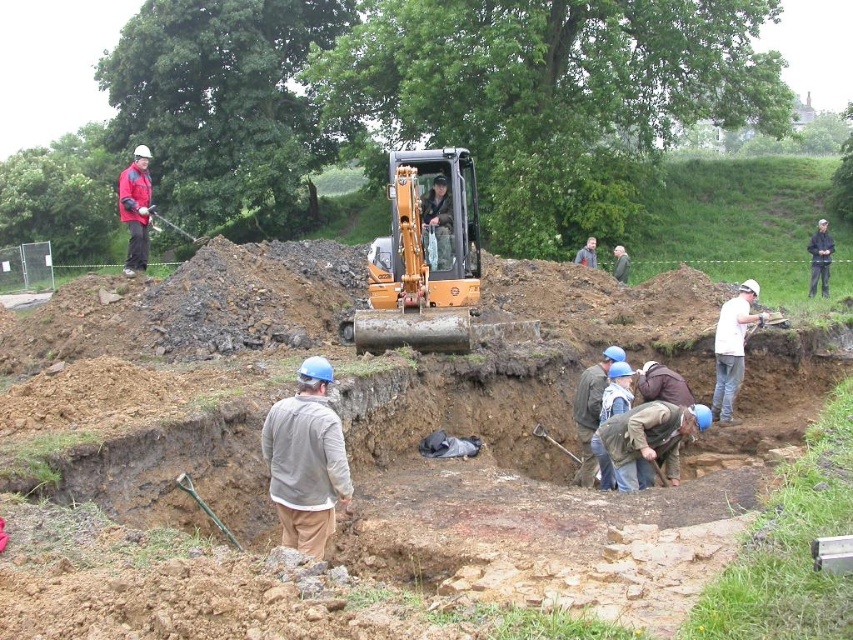
Question: Which point is farther to the camera?

Choices:
 (A) (821, 225)
 (B) (613, 262)

Answer: (B)

Question: Among these objects, which one is farthest from the camera?

Choices:
 (A) light brown leather jacket at center
 (B) orange metallic excavator at center

Answer: (A)

Question: Is dark blue fabric jacket at upper right positioned at the back of green fabric jacket at center?

Choices:
 (A) no
 (B) yes

Answer: (B)

Question: Can you confirm if orange metallic excavator at center is positioned to the left of light brown leather jacket at center?

Choices:
 (A) no
 (B) yes

Answer: (B)

Question: Among these objects, which one is nearest to the camera?

Choices:
 (A) gray cotton shirt at center
 (B) matte yellow excavator at upper center
 (C) orange metallic excavator at center

Answer: (B)

Question: From the image, what is the correct spatial relationship of matte yellow excavator at upper center in relation to camouflage fabric jacket at center?

Choices:
 (A) right
 (B) left

Answer: (B)